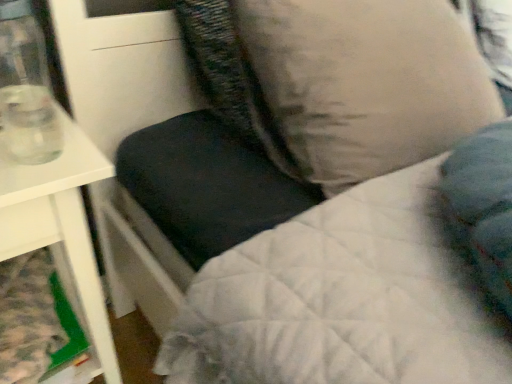
Question: Looking at the image, does beige fabric pillow at upper right seem bigger or smaller compared to white glossy table at left?

Choices:
 (A) big
 (B) small

Answer: (B)

Question: Is beige fabric pillow at upper right to the left or to the right of white glossy table at left in the image?

Choices:
 (A) right
 (B) left

Answer: (A)

Question: Which object is the farthest from the white glossy table at left?

Choices:
 (A) transparent glass at left
 (B) beige fabric pillow at upper right

Answer: (B)

Question: Considering the real-world distances, which object is farthest from the white glossy table at left?

Choices:
 (A) transparent glass at left
 (B) beige fabric pillow at upper right

Answer: (B)